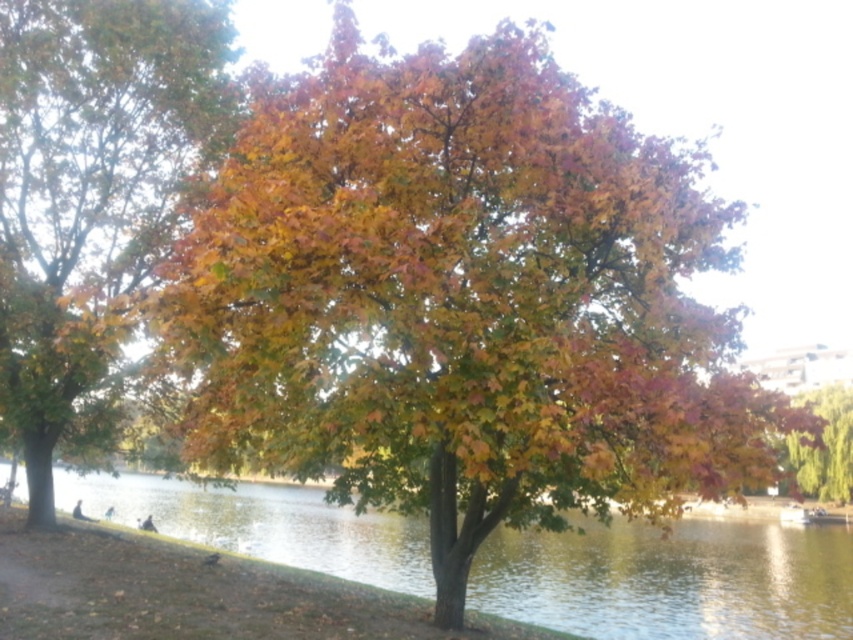
Question: Can you confirm if clear water at center is positioned above autumn leaves tree at right?

Choices:
 (A) yes
 (B) no

Answer: (B)

Question: Where is multicolored leaves at center located in relation to clear water at center in the image?

Choices:
 (A) below
 (B) above

Answer: (B)

Question: Estimate the real-world distances between objects in this image. Which object is closer to the multicolored leaves at center?

Choices:
 (A) clear water at center
 (B) autumn leaves tree at right

Answer: (A)

Question: Considering the real-world distances, which object is closest to the clear water at center?

Choices:
 (A) autumn leaves tree at right
 (B) multicolored leaves at center

Answer: (B)

Question: Based on their relative distances, which object is farther from the multicolored leaves at center?

Choices:
 (A) autumn leaves tree at right
 (B) clear water at center

Answer: (A)

Question: Where is multicolored leaves at center located in relation to autumn leaves tree at right in the image?

Choices:
 (A) right
 (B) left

Answer: (B)